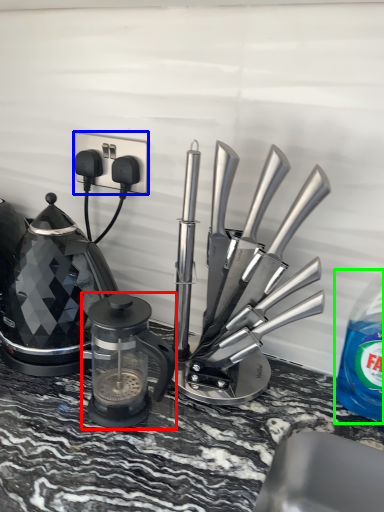
Question: Based on their relative distances, which object is farther from kitchen appliance (highlighted by a red box)? Choose from electric outlet (highlighted by a blue box) and bottle (highlighted by a green box).

Choices:
 (A) electric outlet
 (B) bottle

Answer: (B)